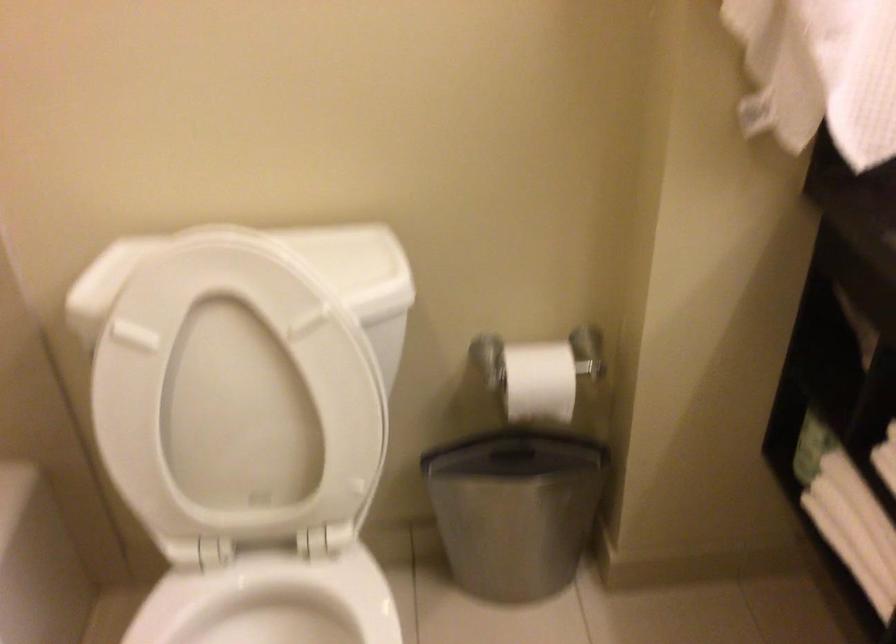
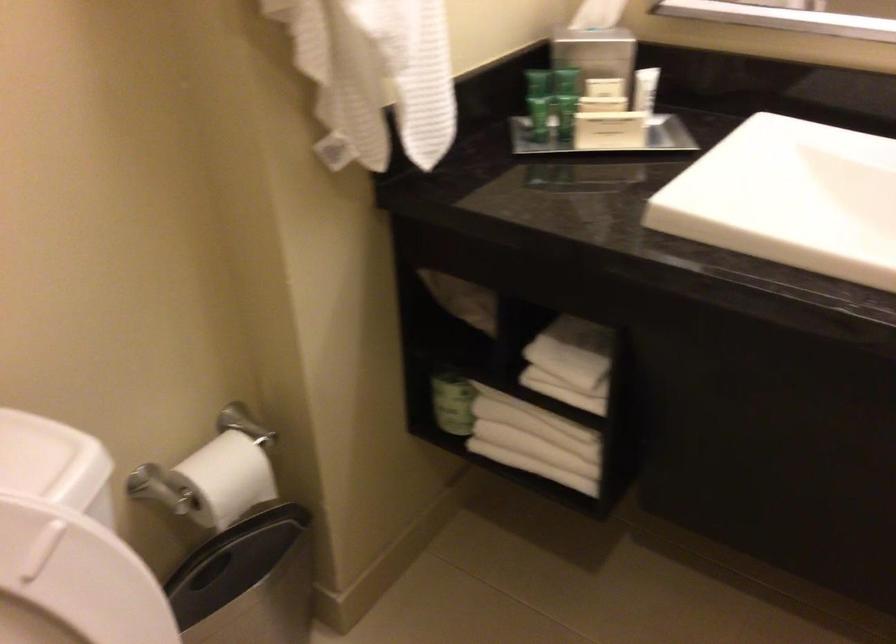
The point at (540, 486) is marked in the first image. Where is the corresponding point in the second image?

(247, 582)